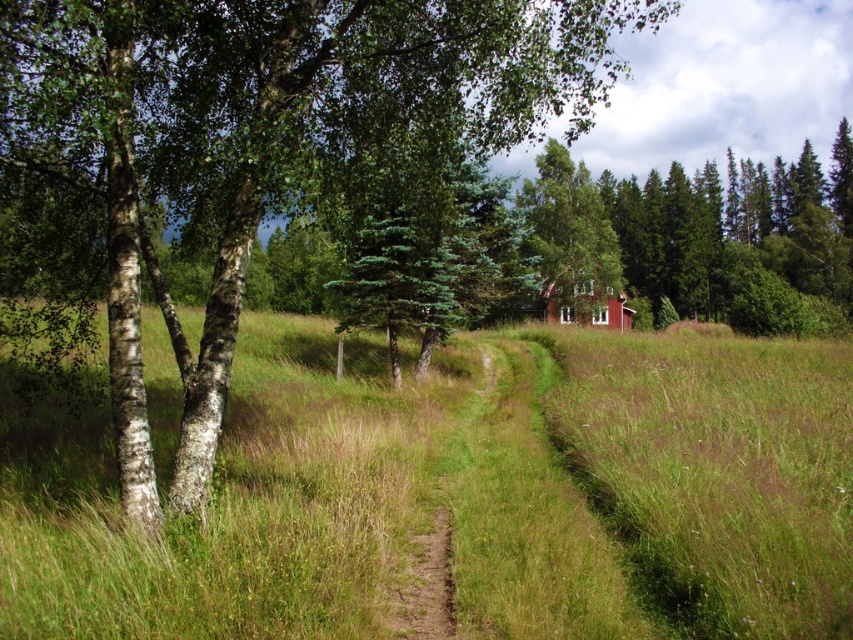
Between point (444, 547) and point (549, 284), which one is positioned behind?

The point (549, 284) is more distant.

Does dirt path at center have a greater width compared to red wooden cabin at center?

No.

Find the location of a particular element. The image size is (853, 640). dirt path at center is located at coordinates (426, 588).

Can you confirm if green matte tree at center is positioned to the right of red wooden cabin at center?

No, green matte tree at center is not to the right of red wooden cabin at center.

Is green matte tree at center bigger than red wooden cabin at center?

Yes.

Does point (131, 378) come closer to viewer compared to point (579, 282)?

Yes, point (131, 378) is in front of point (579, 282).

Identify the location of green matte tree at center. The width and height of the screenshot is (853, 640). (257, 140).

Is the position of green grassy field at center more distant than that of dirt path at center?

No, it is not.

Is point (808, 349) positioned in front of point (427, 548)?

No, (808, 349) is further to viewer.

Which is in front, point (645, 348) or point (428, 532)?

Point (428, 532) is more forward.

The image size is (853, 640). I want to click on green grassy field at center, so click(x=460, y=492).